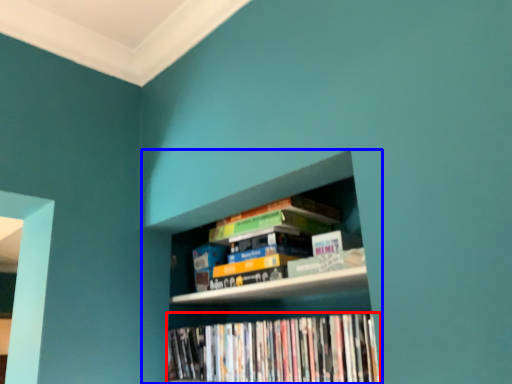
Question: Among these objects, which one is farthest to the camera, book (highlighted by a red box) or bookcase (highlighted by a blue box)?

Choices:
 (A) book
 (B) bookcase

Answer: (A)